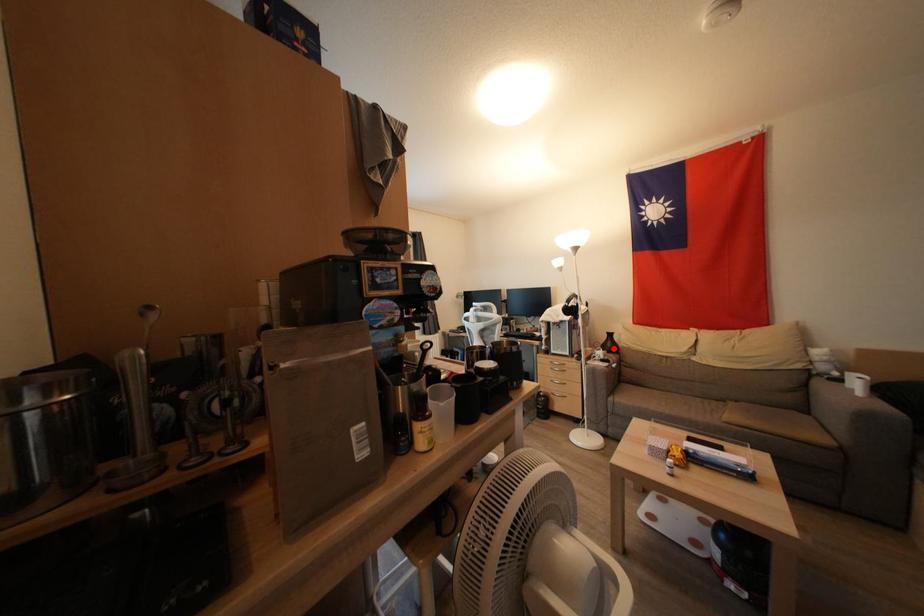
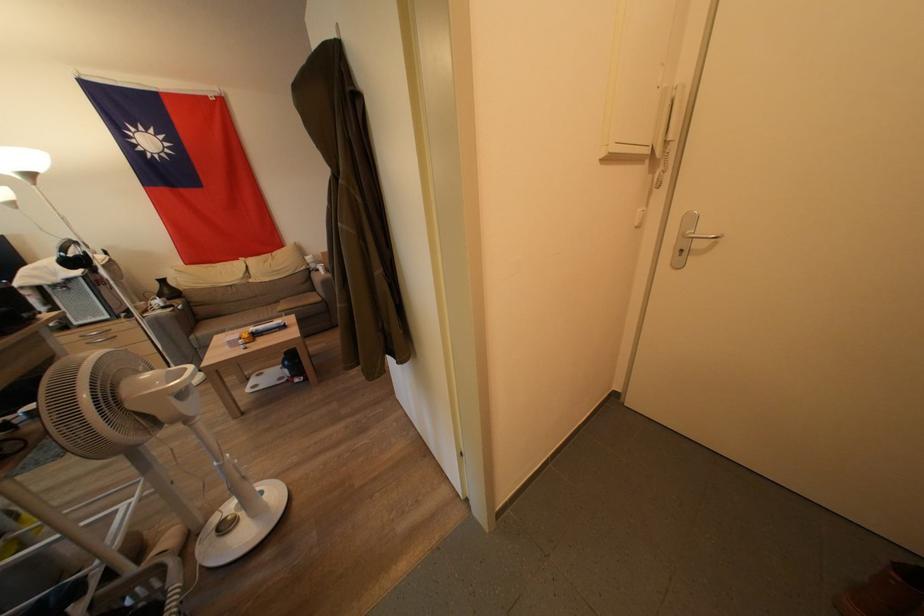
Where in the second image is the point corresponding to the highlighted location from the first image?

(172, 296)